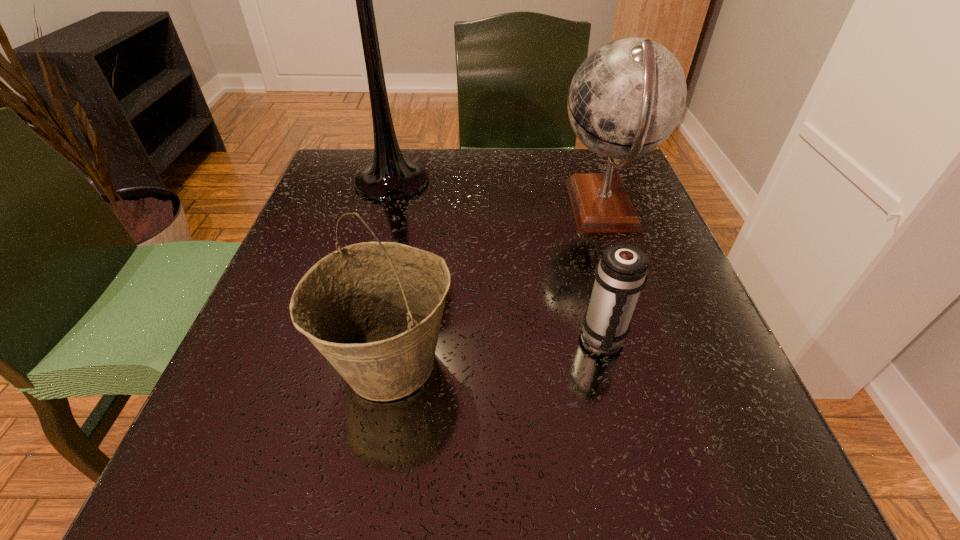
The width and height of the screenshot is (960, 540). Identify the location of table lamp located in the far edge section of the desktop. (390, 177).

Image resolution: width=960 pixels, height=540 pixels. I want to click on globe that is at the far edge, so click(x=627, y=97).

The height and width of the screenshot is (540, 960). I want to click on table lamp that is at the left edge, so click(x=390, y=177).

Where is `wine bucket present at the left edge`? wine bucket present at the left edge is located at coordinates (373, 309).

Where is `globe at the right edge`? The height and width of the screenshot is (540, 960). globe at the right edge is located at coordinates (627, 97).

Where is `thermos bottle present at the right edge`? This screenshot has width=960, height=540. thermos bottle present at the right edge is located at coordinates (620, 275).

What are the coordinates of `object present at the far left corner` in the screenshot? It's located at (390, 177).

I want to click on object situated at the far right corner, so click(627, 97).

The width and height of the screenshot is (960, 540). In the image, there is a desktop. Find the location of `vacant space at the far edge`. vacant space at the far edge is located at coordinates (476, 151).

Where is `vacant space at the near edge of the desktop`? vacant space at the near edge of the desktop is located at coordinates (571, 476).